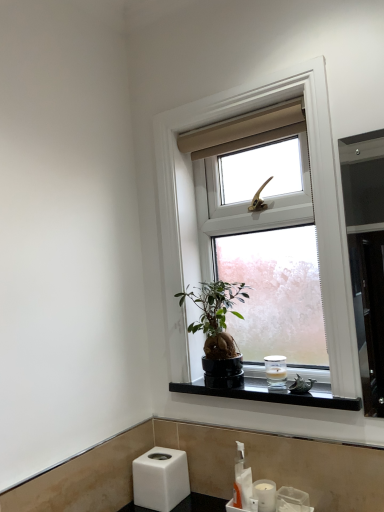
Where is `spots to the right of white frosted glass candle at lower right, positioned as the second toiletry in bottom-to-top order`? spots to the right of white frosted glass candle at lower right, positioned as the second toiletry in bottom-to-top order is located at coordinates (308, 385).